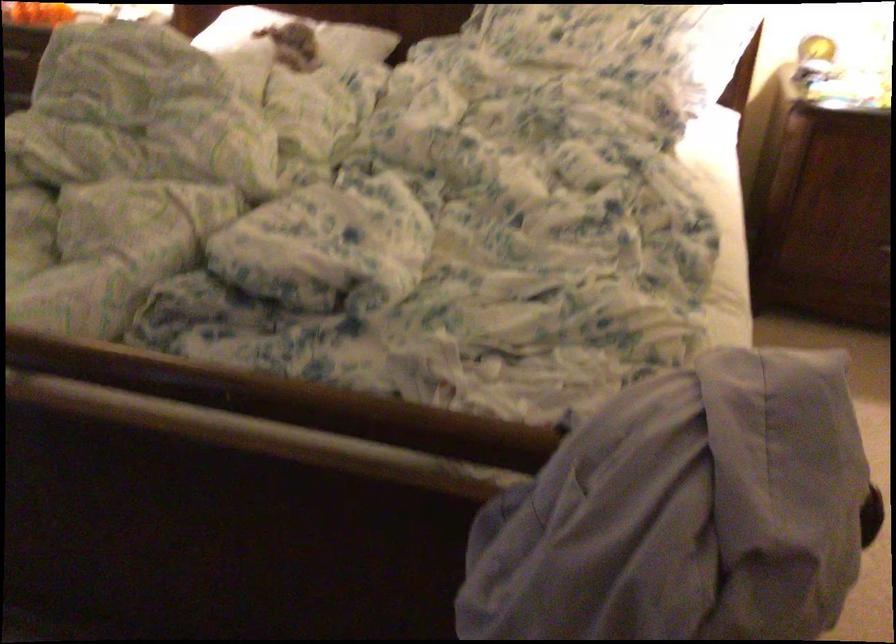
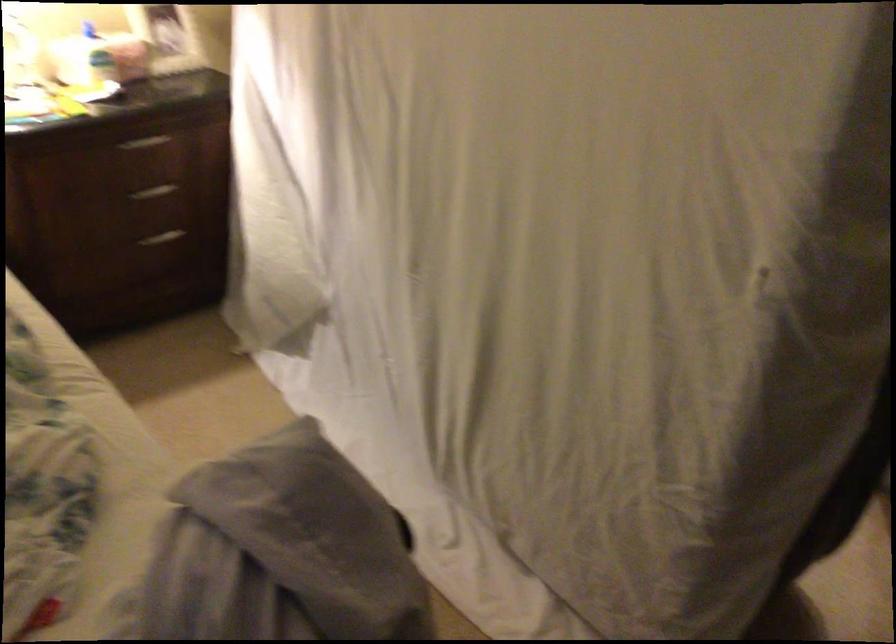
Question: The camera is either moving clockwise (left) or counter-clockwise (right) around the object. The first image is from the beginning of the video and the second image is from the end. Is the camera moving left or right when shooting the video?

Choices:
 (A) Left
 (B) Right

Answer: (A)